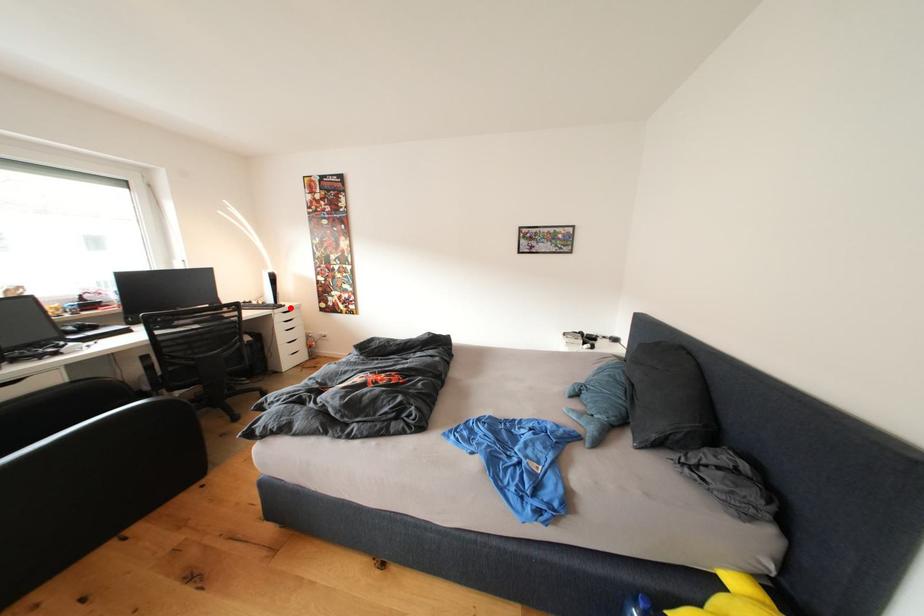
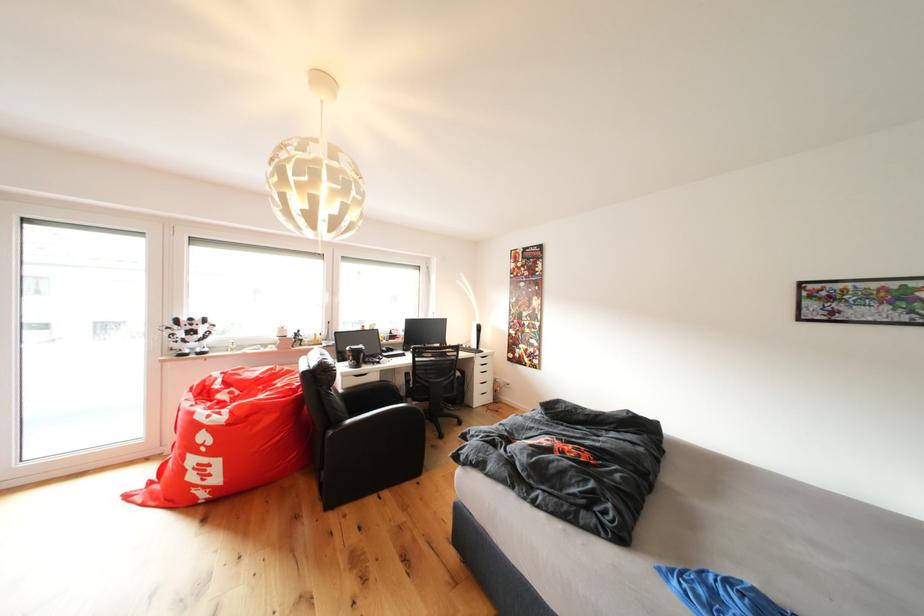
Where in the second image is the point corresponding to the highlighted location from the first image?

(490, 354)